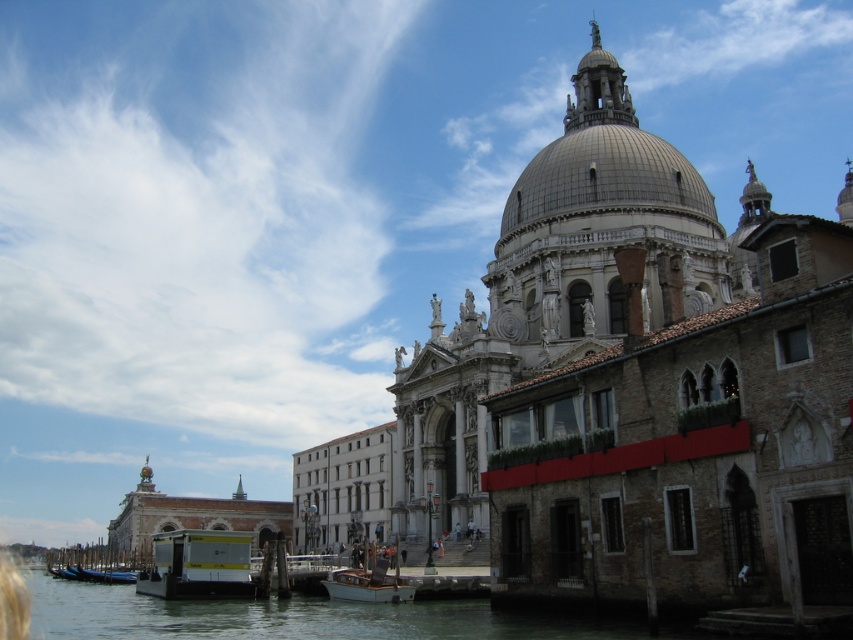
Question: Based on their relative distances, which object is nearer to the gray stone dome at center?

Choices:
 (A) wooden polished boat at lower center
 (B) clear water at lower left
 (C) white glossy boat at lower left

Answer: (A)

Question: Does clear water at lower left have a larger size compared to white glossy boat at lower left?

Choices:
 (A) no
 (B) yes

Answer: (B)

Question: Which point is closer to the camera taking this photo?

Choices:
 (A) (701, 218)
 (B) (315, 609)

Answer: (B)

Question: Can you confirm if white glossy boat at lower left is positioned to the left of wooden polished boat at lower center?

Choices:
 (A) yes
 (B) no

Answer: (A)

Question: Is clear water at lower left smaller than gray stone dome at center?

Choices:
 (A) yes
 (B) no

Answer: (B)

Question: Which object is closer to the camera taking this photo?

Choices:
 (A) white glossy boat at lower left
 (B) wooden polished boat at lower center
 (C) gray stone dome at center

Answer: (B)